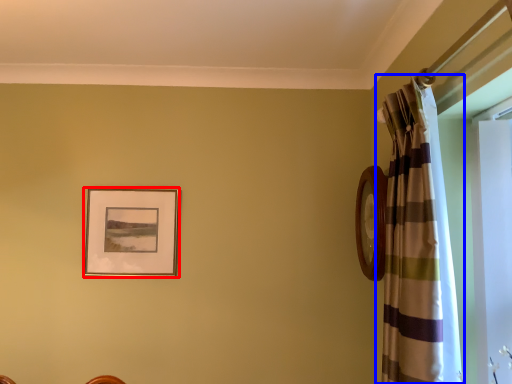
Question: Which of the following is the farthest to the observer, picture frame (highlighted by a red box) or curtain (highlighted by a blue box)?

Choices:
 (A) picture frame
 (B) curtain

Answer: (A)